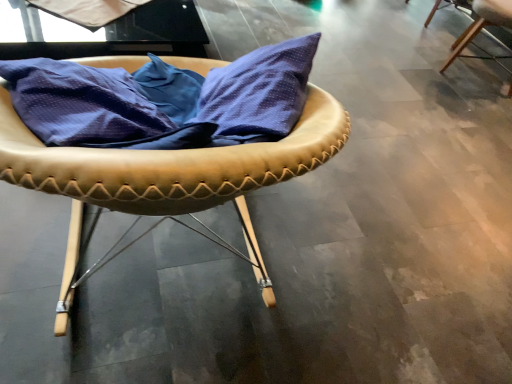
Question: Is white matte fabric at upper left taller than light brown leather chair at upper right, which ranks as the first chair in back-to-front order?

Choices:
 (A) yes
 (B) no

Answer: (B)

Question: From a real-world perspective, is white matte fabric at upper left located beneath light brown leather chair at upper right, the 1th chair in the top-to-bottom sequence?

Choices:
 (A) no
 (B) yes

Answer: (A)

Question: From the image's perspective, is white matte fabric at upper left beneath light brown leather chair at upper right, which ranks as the 2th chair in left-to-right order?

Choices:
 (A) no
 (B) yes

Answer: (B)

Question: Is white matte fabric at upper left positioned with its back to light brown leather chair at upper right, which ranks as the 2th chair in left-to-right order?

Choices:
 (A) yes
 (B) no

Answer: (B)

Question: Is white matte fabric at upper left smaller than light brown leather chair at upper right, placed as the 2th chair when sorted from bottom to top?

Choices:
 (A) yes
 (B) no

Answer: (A)

Question: Is point (212, 87) closer or farther from the camera than point (123, 6)?

Choices:
 (A) closer
 (B) farther

Answer: (A)

Question: From the image's perspective, is leather-like tan chair at center, the 2th chair positioned from the top, above or below white matte fabric at upper left?

Choices:
 (A) above
 (B) below

Answer: (B)

Question: From a real-world perspective, is leather-like tan chair at center, placed as the 2th chair when sorted from right to left, positioned above or below white matte fabric at upper left?

Choices:
 (A) above
 (B) below

Answer: (A)

Question: Is leather-like tan chair at center, which ranks as the first chair in left-to-right order, bigger or smaller than white matte fabric at upper left?

Choices:
 (A) small
 (B) big

Answer: (B)

Question: Looking at the image, does light brown leather chair at upper right, acting as the first chair starting from the right, seem bigger or smaller compared to white matte fabric at upper left?

Choices:
 (A) small
 (B) big

Answer: (B)

Question: From their relative heights in the image, would you say light brown leather chair at upper right, which appears as the 2th chair when viewed from the front, is taller or shorter than white matte fabric at upper left?

Choices:
 (A) short
 (B) tall

Answer: (B)

Question: Do you think light brown leather chair at upper right, which appears as the 2th chair when viewed from the front, is within white matte fabric at upper left, or outside of it?

Choices:
 (A) inside
 (B) outside

Answer: (B)

Question: Considering the positions of point (x=510, y=56) and point (x=104, y=18), is point (x=510, y=56) closer or farther from the camera than point (x=104, y=18)?

Choices:
 (A) closer
 (B) farther

Answer: (B)

Question: Is point (52, 1) closer or farther from the camera than point (321, 114)?

Choices:
 (A) farther
 (B) closer

Answer: (A)

Question: From a real-world perspective, relative to leather-like tan chair at center, the 1th chair from the bottom, is white matte fabric at upper left vertically above or below?

Choices:
 (A) above
 (B) below

Answer: (B)